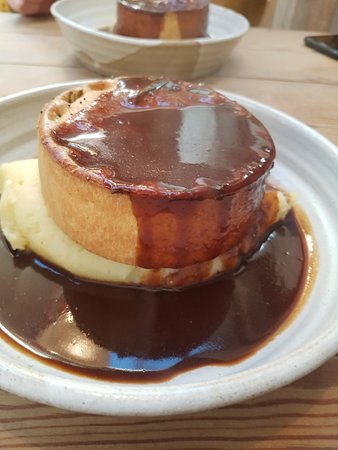
At what (x,y) coordinates should I click in order to perform the action: click on part of the plate with no gravy. Please return your answer as a coordinate pair (x, y). Looking at the image, I should click on (x=26, y=153).